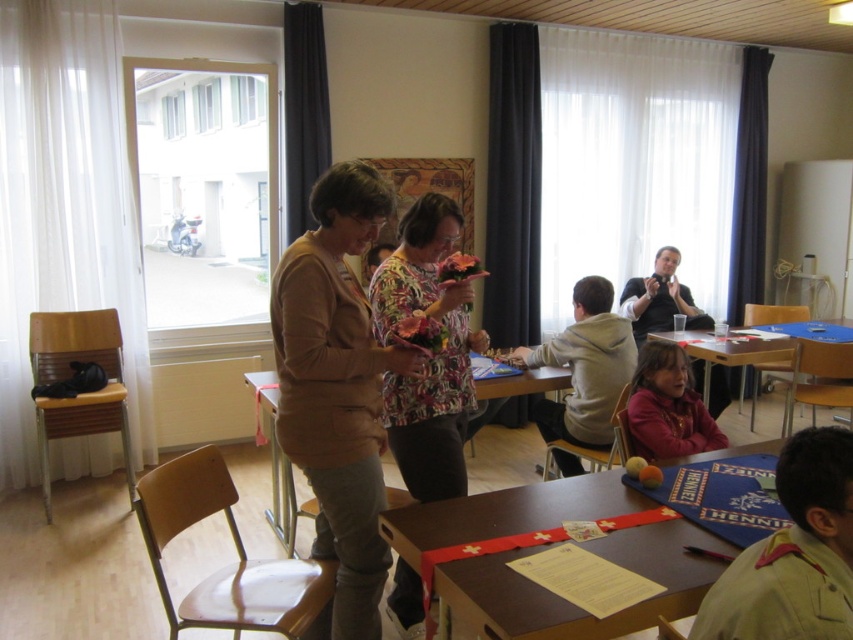
You are standing in the classroom and see the point marked at coordinates (666, 406). What object is located at that position?

The point at coordinates (666, 406) corresponds to the matte pink hoodie at lower right.

You are a photographer setting up for an event in the classroom. You need to ensure that the white sheer curtain at right does not block the brown wooden table at center during the photoshoot. Is the curtain currently positioned in a way that might obstruct the table?

The white sheer curtain at right is positioned over the brown wooden table at center, so it is currently blocking the table and may obstruct it during the photoshoot.